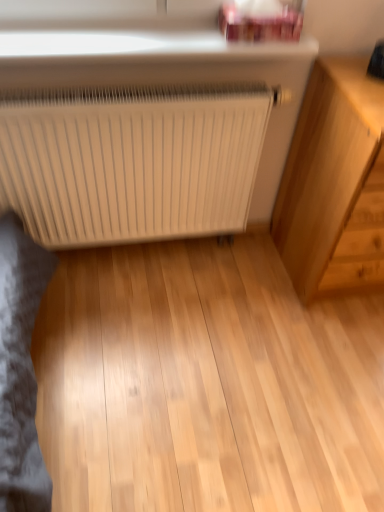
I want to click on vacant location below white matte radiator at center (from a real-world perspective), so click(x=147, y=254).